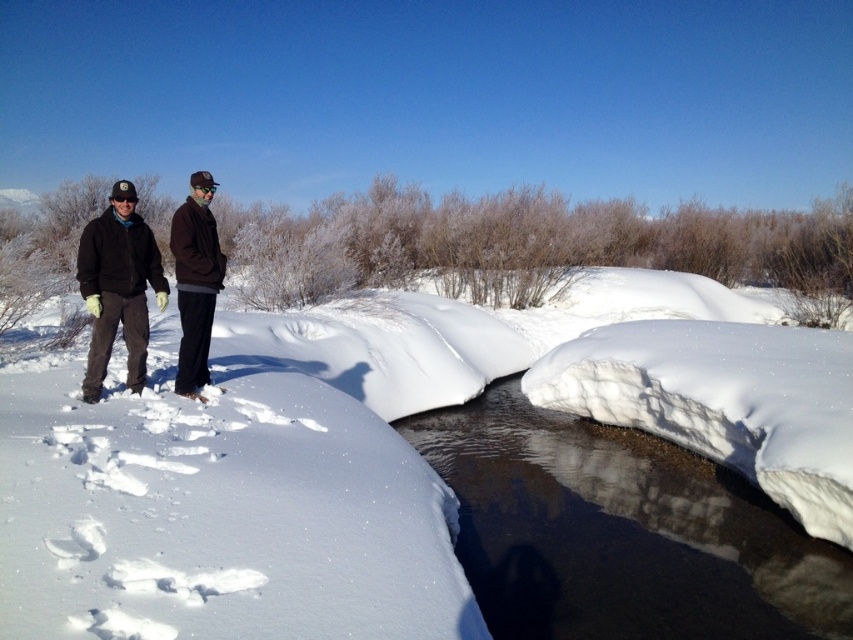
Does white ice stream at center have a lesser width compared to dark brown jacket at left?

Yes.

The width and height of the screenshot is (853, 640). What do you see at coordinates (619, 532) in the screenshot? I see `white ice stream at center` at bounding box center [619, 532].

Between point (434, 422) and point (206, 250), which one is positioned behind?

Point (434, 422)

Where is `white ice stream at center`? The width and height of the screenshot is (853, 640). white ice stream at center is located at coordinates (619, 532).

Does white ice stream at center have a lesser width compared to dark brown jacket at center?

Incorrect, white ice stream at center's width is not less than dark brown jacket at center's.

Can you confirm if white ice stream at center is positioned to the right of dark brown jacket at center?

Correct, you'll find white ice stream at center to the right of dark brown jacket at center.

The width and height of the screenshot is (853, 640). Describe the element at coordinates (619, 532) in the screenshot. I see `white ice stream at center` at that location.

Image resolution: width=853 pixels, height=640 pixels. I want to click on white ice stream at center, so click(619, 532).

How far apart are white fluffy snow at center and white ice stream at center?

The distance of white fluffy snow at center from white ice stream at center is 23.40 feet.

Measure the distance between point (x=734, y=308) and camera.

The distance of point (x=734, y=308) from camera is 25.56 meters.

Where is `white fluffy snow at center`? The height and width of the screenshot is (640, 853). white fluffy snow at center is located at coordinates (274, 468).

Locate an element on the screen. The width and height of the screenshot is (853, 640). white fluffy snow at center is located at coordinates (274, 468).